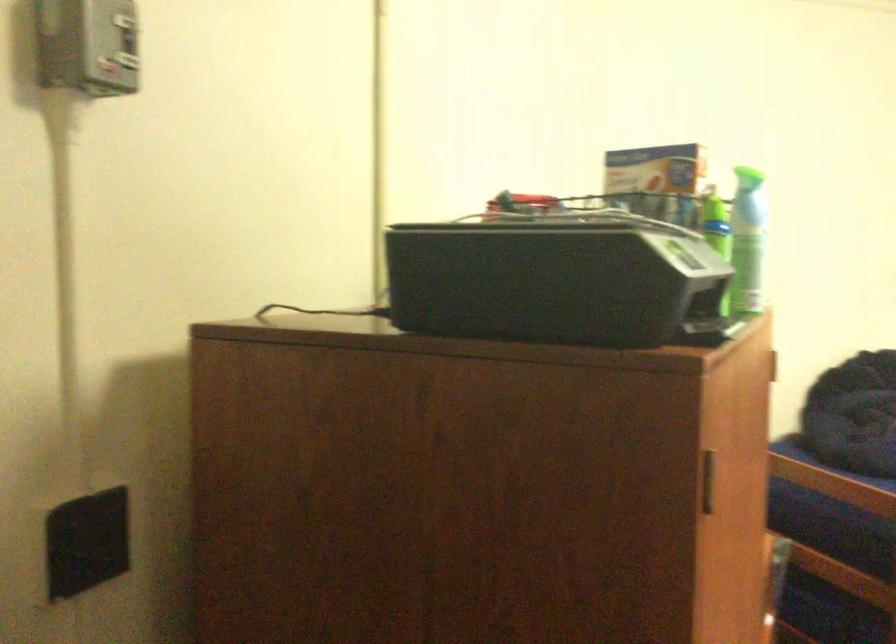
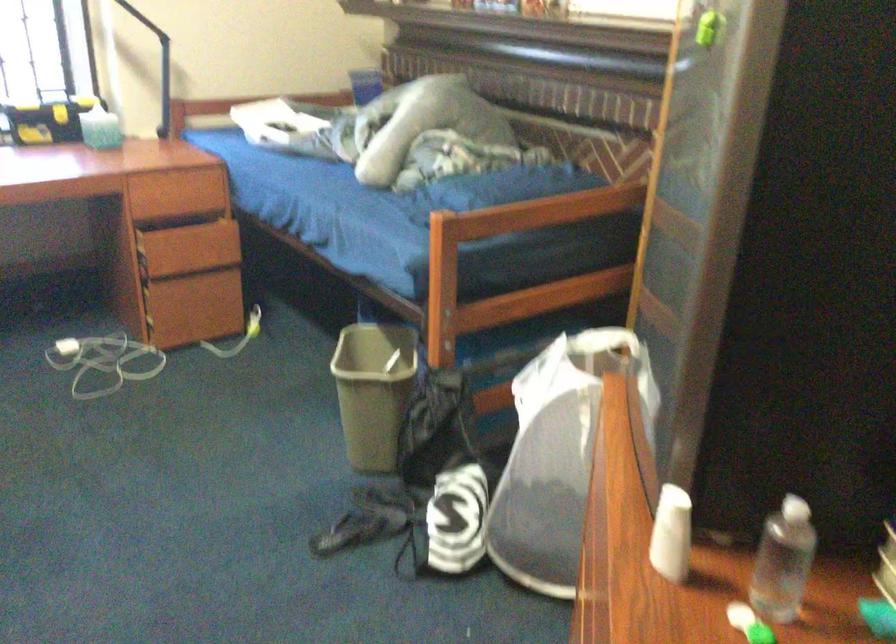
From the picture: How did the camera likely rotate?

The rotation direction of the camera is right-down.